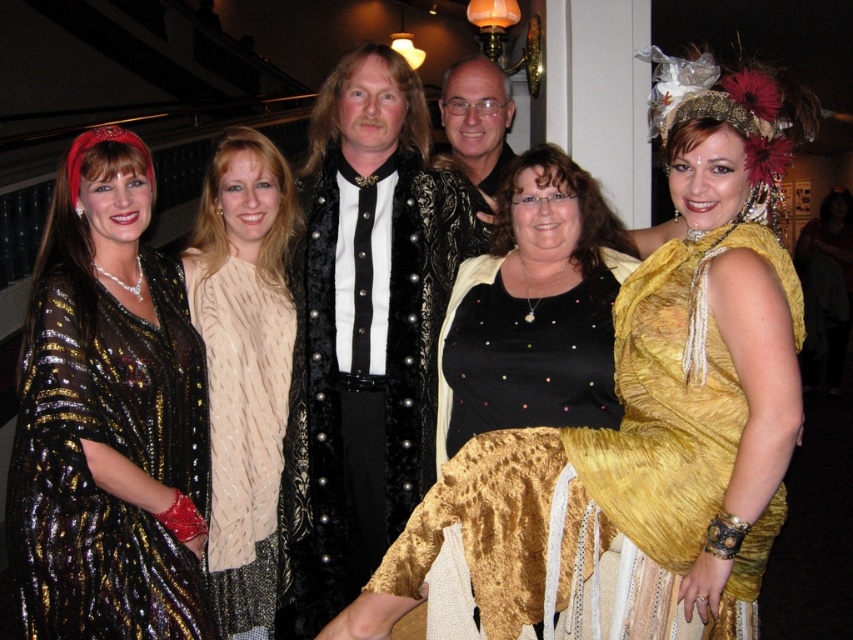
Question: Which object is the farthest from the beige knitted sweater at center?

Choices:
 (A) velvet black vest at center
 (B) shiny sequined dress at left

Answer: (B)

Question: Estimate the real-world distances between objects in this image. Which object is farther from the shiny sequined dress at left?

Choices:
 (A) beige knitted sweater at center
 (B) gold sequined dress at center
 (C) velvet black vest at center
 (D) black sequined dress at center

Answer: (B)

Question: Is gold sequined dress at center positioned in front of black sequined dress at center?

Choices:
 (A) no
 (B) yes

Answer: (B)

Question: Which point appears closest to the camera in this image?

Choices:
 (A) (361, 586)
 (B) (473, 432)

Answer: (B)

Question: In this image, where is velvet black vest at center located relative to black sequined dress at center?

Choices:
 (A) below
 (B) above

Answer: (A)

Question: Observing the image, what is the correct spatial positioning of black sequined dress at center in reference to beige knitted sweater at center?

Choices:
 (A) below
 (B) above

Answer: (B)